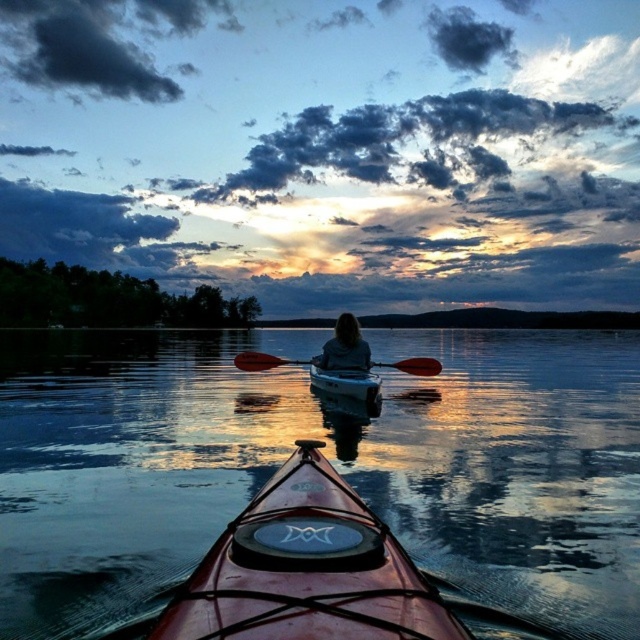
Is point (355, 378) farther from viewer compared to point (428, 358)?

No.

You are a GUI agent. You are given a task and a screenshot of the screen. Output one action in this format:
    pyautogui.click(x=<x>, y=<y>)
    Task: Click on the matte white canoe at center
    The image size is (640, 640).
    Given the screenshot: What is the action you would take?
    pyautogui.click(x=346, y=381)

Is point (316, 388) positioned behind point (253, 368)?

No, it is in front of (253, 368).

Find the location of a particular element. This screenshot has height=640, width=640. matte white canoe at center is located at coordinates (346, 381).

Does dark brown hair at center have a smaller size compared to orange paddle at center?

Indeed, dark brown hair at center has a smaller size compared to orange paddle at center.

Describe the element at coordinates (344, 348) in the screenshot. The height and width of the screenshot is (640, 640). I see `dark brown hair at center` at that location.

Between point (330, 353) and point (376, 364), which one is positioned in front?

Point (330, 353) is more forward.

Find the location of a particular element. This screenshot has width=640, height=640. dark brown hair at center is located at coordinates (344, 348).

From the picture: Is glossy water at center to the left of orange paddle at center from the viewer's perspective?

Indeed, glossy water at center is positioned on the left side of orange paddle at center.

Identify the location of glossy water at center. (328, 456).